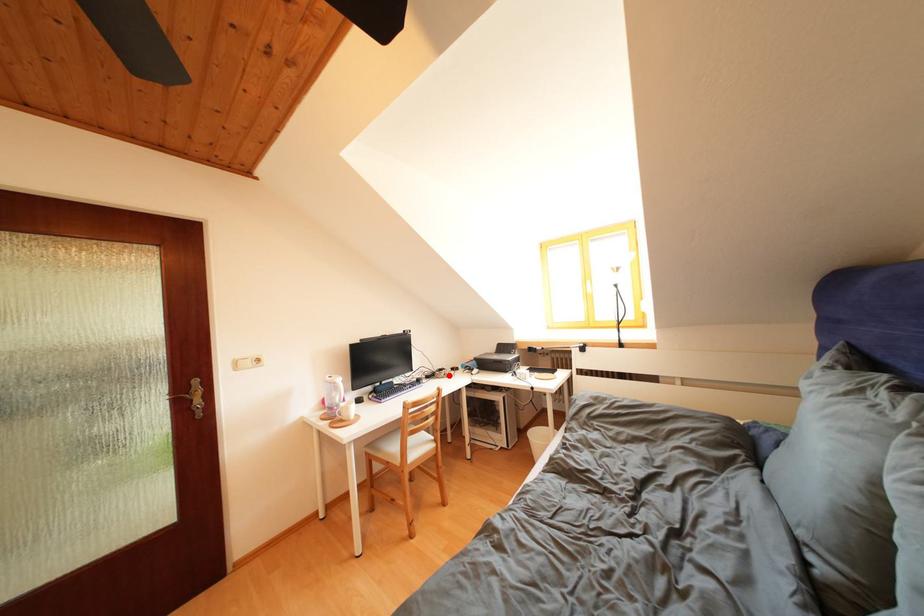
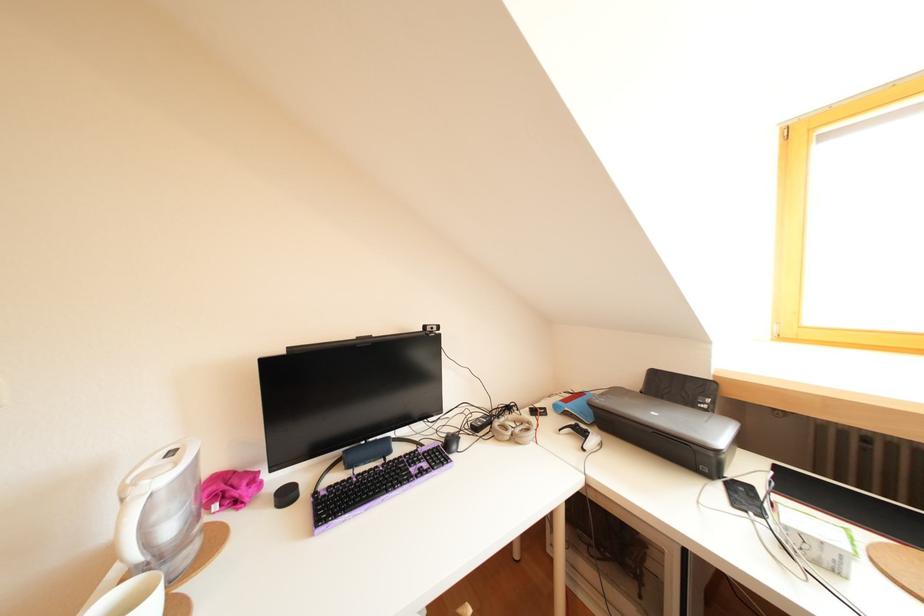
Where in the second image is the point corresponding to the highlighted location from the first image?

(516, 413)